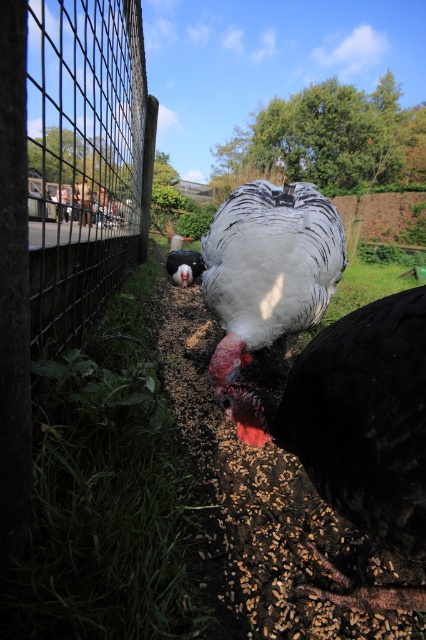
Question: Can you confirm if white feathered turkey at center is smaller than shiny black bird at center?

Choices:
 (A) yes
 (B) no

Answer: (B)

Question: Among these points, which one is farthest from the camera?

Choices:
 (A) (402, 368)
 (B) (316, 276)

Answer: (B)

Question: Is white glossy turkey at center smaller than shiny black bird at center?

Choices:
 (A) yes
 (B) no

Answer: (A)

Question: Among these objects, which one is farthest from the camera?

Choices:
 (A) shiny black bird at center
 (B) white glossy turkey at center

Answer: (A)

Question: Which object is positioned farthest from the white glossy turkey at center?

Choices:
 (A) white feathered turkey at center
 (B) shiny black bird at center

Answer: (B)

Question: Does white feathered turkey at center appear on the left side of shiny black bird at center?

Choices:
 (A) yes
 (B) no

Answer: (B)